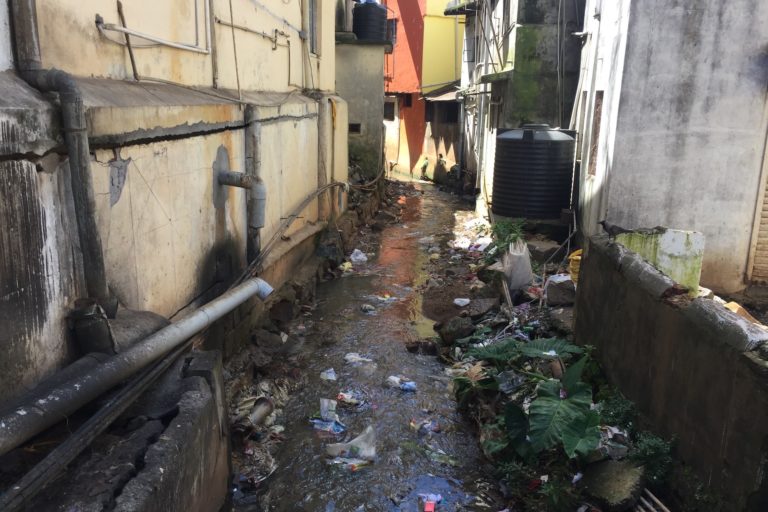
The width and height of the screenshot is (768, 512). In order to click on chipped wall in this screenshot , I will do `click(118, 174)`.